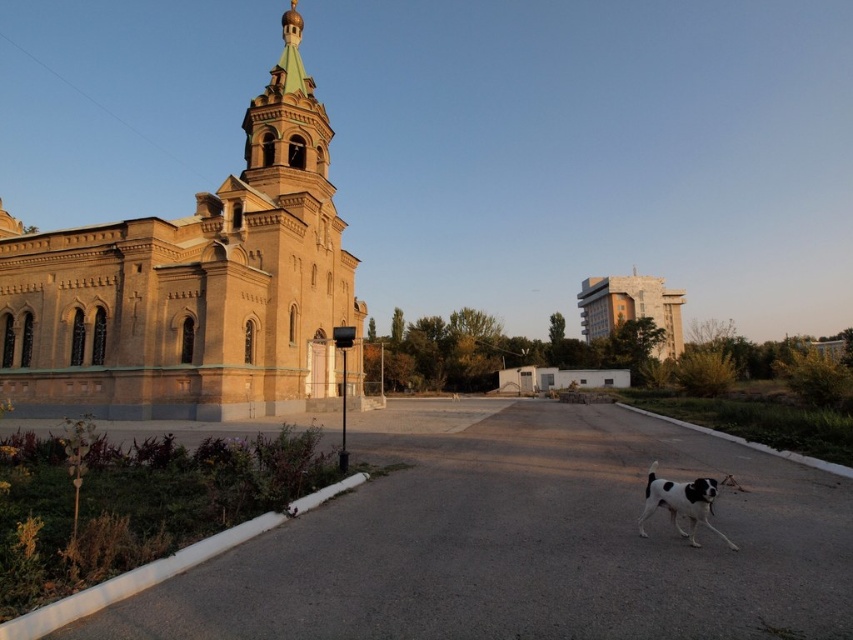
Question: Among these points, which one is nearest to the camera?

Choices:
 (A) (305, 129)
 (B) (222, 278)

Answer: (B)

Question: Considering the real-world distances, which object is closest to the black and white fur dog at lower right?

Choices:
 (A) brown brick church at left
 (B) matte beige building at upper right
 (C) green copper spire at upper center

Answer: (A)

Question: In this image, where is green copper spire at upper center located relative to matte beige building at upper right?

Choices:
 (A) above
 (B) below

Answer: (A)

Question: Can you confirm if brown brick church at left is positioned above black and white fur dog at lower right?

Choices:
 (A) no
 (B) yes

Answer: (B)

Question: Estimate the real-world distances between objects in this image. Which object is farther from the matte beige building at upper right?

Choices:
 (A) brown brick church at left
 (B) black and white fur dog at lower right
 (C) green copper spire at upper center

Answer: (B)

Question: Is green copper spire at upper center above black and white fur dog at lower right?

Choices:
 (A) yes
 (B) no

Answer: (A)